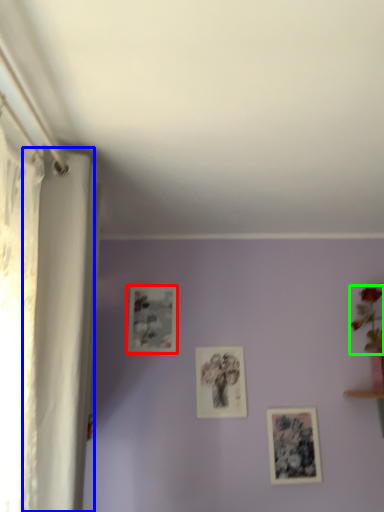
Question: Which object is positioned closest to picture frame (highlighted by a red box)? Select from curtain (highlighted by a blue box) and floral arrangement (highlighted by a green box).

Choices:
 (A) curtain
 (B) floral arrangement

Answer: (A)